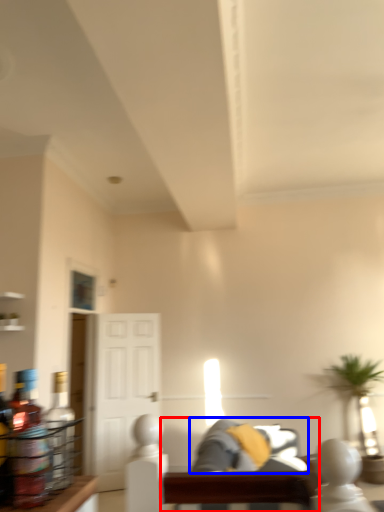
Question: Which point is closer to the camera, couch (highlighted by a red box) or couch (highlighted by a blue box)?

Choices:
 (A) couch
 (B) couch

Answer: (A)